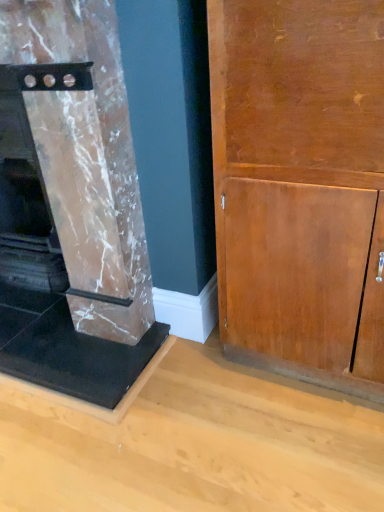
In order to face wooden cabinet at right, should I rotate leftwards or rightwards?

Rotate right and turn 16.777 degrees.

This screenshot has width=384, height=512. What do you see at coordinates (300, 186) in the screenshot?
I see `wooden cabinet at right` at bounding box center [300, 186].

Find the location of a particular element. The image size is (384, 512). wooden cabinet at right is located at coordinates (300, 186).

This screenshot has width=384, height=512. What do you see at coordinates (75, 210) in the screenshot? I see `marble fireplace at left` at bounding box center [75, 210].

The height and width of the screenshot is (512, 384). Find the location of `marble fireplace at left`. marble fireplace at left is located at coordinates (75, 210).

Find the location of a particular element. wooden cabinet at right is located at coordinates [300, 186].

Visually, is marble fireplace at left positioned to the left or to the right of wooden cabinet at right?

marble fireplace at left is positioned on wooden cabinet at right's left side.

Is marble fireplace at left positioned in front of wooden cabinet at right?

No, marble fireplace at left is further to the viewer.

Consider the image. Which is further, (121, 116) or (353, 385)?

The point (353, 385) is more distant.

From the image's perspective, between marble fireplace at left and wooden cabinet at right, which one is located above?

marble fireplace at left is shown above in the image.

From a real-world perspective, who is located lower, marble fireplace at left or wooden cabinet at right?

From a 3D spatial view, wooden cabinet at right is below.

In terms of width, does marble fireplace at left look wider or thinner when compared to wooden cabinet at right?

marble fireplace at left is wider than wooden cabinet at right.

Which of these two, marble fireplace at left or wooden cabinet at right, stands taller?

With more height is marble fireplace at left.

Which of these two, marble fireplace at left or wooden cabinet at right, is smaller?

Smaller between the two is wooden cabinet at right.

Would you say marble fireplace at left is inside or outside wooden cabinet at right?

marble fireplace at left is spatially situated outside wooden cabinet at right.

Is there a large distance between marble fireplace at left and wooden cabinet at right?

No.

Is marble fireplace at left positioned with its back to wooden cabinet at right?

marble fireplace at left does not have its back to wooden cabinet at right.

How many degrees apart are the facing directions of marble fireplace at left and wooden cabinet at right?

The facing directions of marble fireplace at left and wooden cabinet at right are 1.03 degrees apart.

This screenshot has height=512, width=384. What are the coordinates of `fireplace above the wooden cabinet at right (from the image's perspective)` in the screenshot? It's located at (75, 210).

Which object is positioned more to the right, wooden cabinet at right or marble fireplace at left?

Positioned to the right is wooden cabinet at right.

Does wooden cabinet at right come behind marble fireplace at left?

No, wooden cabinet at right is in front of marble fireplace at left.

Which point is more distant from viewer, (353, 22) or (140, 298)?

Positioned behind is point (140, 298).

From the image's perspective, which one is positioned lower, wooden cabinet at right or marble fireplace at left?

wooden cabinet at right is shown below in the image.

From a real-world perspective, which object stands above the other?

marble fireplace at left is physically above.

Considering the relative sizes of wooden cabinet at right and marble fireplace at left in the image provided, is wooden cabinet at right wider than marble fireplace at left?

No, wooden cabinet at right is not wider than marble fireplace at left.

Does wooden cabinet at right have a greater height compared to marble fireplace at left?

In fact, wooden cabinet at right may be shorter than marble fireplace at left.

Between wooden cabinet at right and marble fireplace at left, which one has larger size?

marble fireplace at left is bigger.

Is marble fireplace at left located within wooden cabinet at right?

No, marble fireplace at left is located outside of wooden cabinet at right.

In the scene shown: Does wooden cabinet at right touch marble fireplace at left?

wooden cabinet at right is not next to marble fireplace at left, and they're not touching.

Is wooden cabinet at right facing away from marble fireplace at left?

No.

How different are the orientations of wooden cabinet at right and marble fireplace at left in degrees?

1.03 degrees separate the facing orientations of wooden cabinet at right and marble fireplace at left.

Locate an element on the screen. cupboard that appears in front of the marble fireplace at left is located at coordinates [300, 186].

Where is `cupboard below the marble fireplace at left (from a real-world perspective)`? The height and width of the screenshot is (512, 384). cupboard below the marble fireplace at left (from a real-world perspective) is located at coordinates (300, 186).

I want to click on fireplace located on the left of wooden cabinet at right, so click(x=75, y=210).